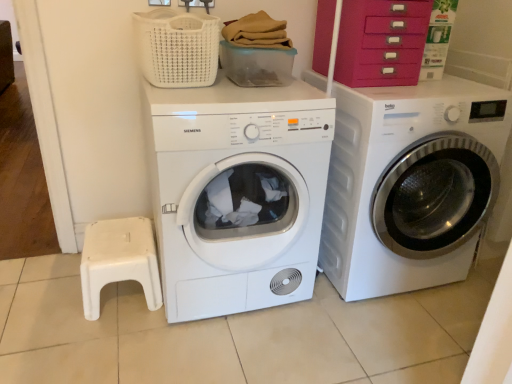
Image resolution: width=512 pixels, height=384 pixels. I want to click on free space in front of velvet pink drawer at upper right, so click(x=401, y=96).